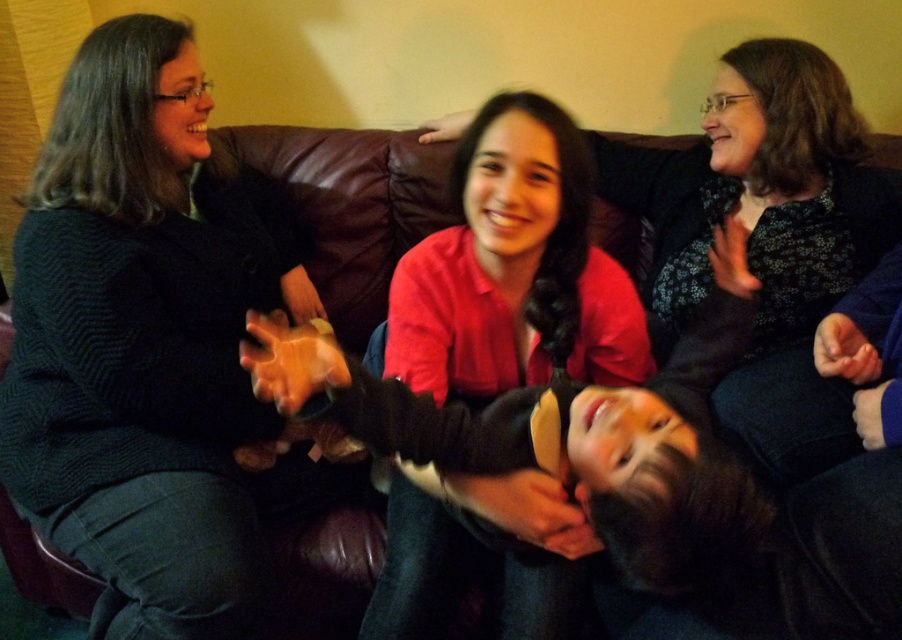
Does black sweater at left have a larger size compared to matte red shirt at center?

Indeed, black sweater at left has a larger size compared to matte red shirt at center.

Who is more forward, [258,554] or [480,198]?

Positioned in front is point [480,198].

Locate an element on the screen. black sweater at left is located at coordinates (146, 352).

Where is `black sweater at left`? Image resolution: width=902 pixels, height=640 pixels. black sweater at left is located at coordinates coord(146,352).